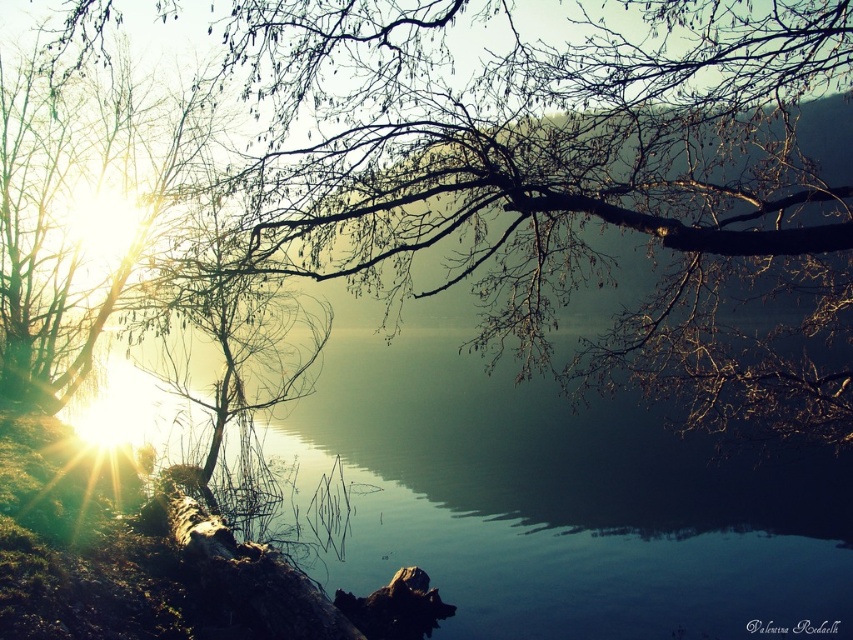
Is brown textured branches at upper center wider than transparent water at center?

No.

Locate an element on the screen. The height and width of the screenshot is (640, 853). brown textured branches at upper center is located at coordinates (566, 180).